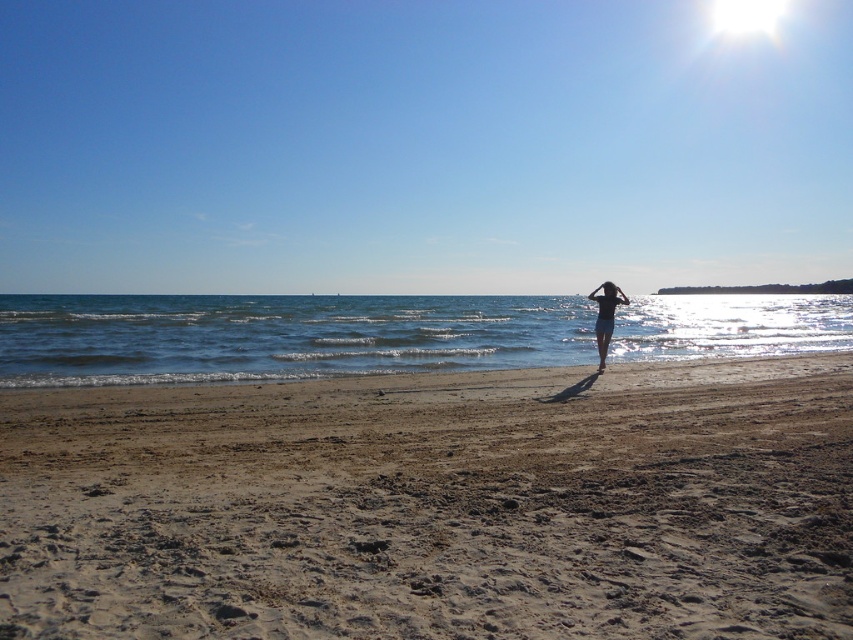
Question: Which point appears closest to the camera in this image?

Choices:
 (A) (552, 358)
 (B) (720, 460)

Answer: (B)

Question: Considering the relative positions of brown sandy beach at lower center and blue water at center in the image provided, where is brown sandy beach at lower center located with respect to blue water at center?

Choices:
 (A) left
 (B) right

Answer: (B)

Question: Can you confirm if brown sandy beach at lower center is bigger than blue water at center?

Choices:
 (A) yes
 (B) no

Answer: (B)

Question: Does blue water at center have a larger size compared to blue fabric swimsuit at center?

Choices:
 (A) yes
 (B) no

Answer: (A)

Question: Which object is closer to the camera taking this photo?

Choices:
 (A) brown sandy beach at lower center
 (B) blue water at center
 (C) blue fabric swimsuit at center

Answer: (A)

Question: Estimate the real-world distances between objects in this image. Which object is closer to the blue water at center?

Choices:
 (A) brown sandy beach at lower center
 (B) blue fabric swimsuit at center

Answer: (A)